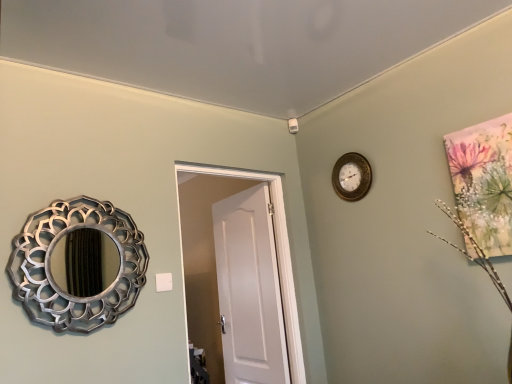
Question: Does silver metallic mirror at left come behind gold metallic wall clock at upper center?

Choices:
 (A) yes
 (B) no

Answer: (B)

Question: From a real-world perspective, is silver metallic mirror at left physically below gold metallic wall clock at upper center?

Choices:
 (A) yes
 (B) no

Answer: (A)

Question: Considering the relative positions of silver metallic mirror at left and gold metallic wall clock at upper center in the image provided, is silver metallic mirror at left to the left of gold metallic wall clock at upper center from the viewer's perspective?

Choices:
 (A) yes
 (B) no

Answer: (A)

Question: Does silver metallic mirror at left have a larger size compared to gold metallic wall clock at upper center?

Choices:
 (A) yes
 (B) no

Answer: (A)

Question: Does silver metallic mirror at left have a greater width compared to gold metallic wall clock at upper center?

Choices:
 (A) yes
 (B) no

Answer: (A)

Question: Which is correct: silver metallic mirror at left is inside white matte door at center, or outside of it?

Choices:
 (A) outside
 (B) inside

Answer: (A)

Question: Considering the positions of silver metallic mirror at left and white matte door at center in the image, is silver metallic mirror at left wider or thinner than white matte door at center?

Choices:
 (A) thin
 (B) wide

Answer: (A)

Question: Does point (71, 205) appear closer or farther from the camera than point (287, 271)?

Choices:
 (A) closer
 (B) farther

Answer: (A)

Question: From the image's perspective, is silver metallic mirror at left positioned above or below white matte door at center?

Choices:
 (A) below
 (B) above

Answer: (B)

Question: Is white matte door at center in front of or behind gold metallic wall clock at upper center in the image?

Choices:
 (A) behind
 (B) front

Answer: (B)

Question: Is point (245, 168) positioned closer to the camera than point (348, 157)?

Choices:
 (A) farther
 (B) closer

Answer: (A)

Question: From a real-world perspective, relative to gold metallic wall clock at upper center, is white matte door at center vertically above or below?

Choices:
 (A) above
 (B) below

Answer: (B)

Question: Based on their positions, is white matte door at center located to the left or right of gold metallic wall clock at upper center?

Choices:
 (A) left
 (B) right

Answer: (A)

Question: From a real-world perspective, is white matte door at center physically located above or below silver metallic mirror at left?

Choices:
 (A) above
 (B) below

Answer: (B)

Question: In the image, is white matte door at center on the left side or the right side of silver metallic mirror at left?

Choices:
 (A) right
 (B) left

Answer: (A)